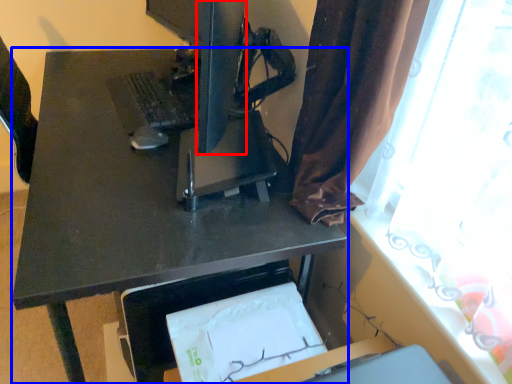
Question: Which object appears closest to the camera in this image, computer monitor (highlighted by a red box) or desk (highlighted by a blue box)?

Choices:
 (A) computer monitor
 (B) desk

Answer: (A)